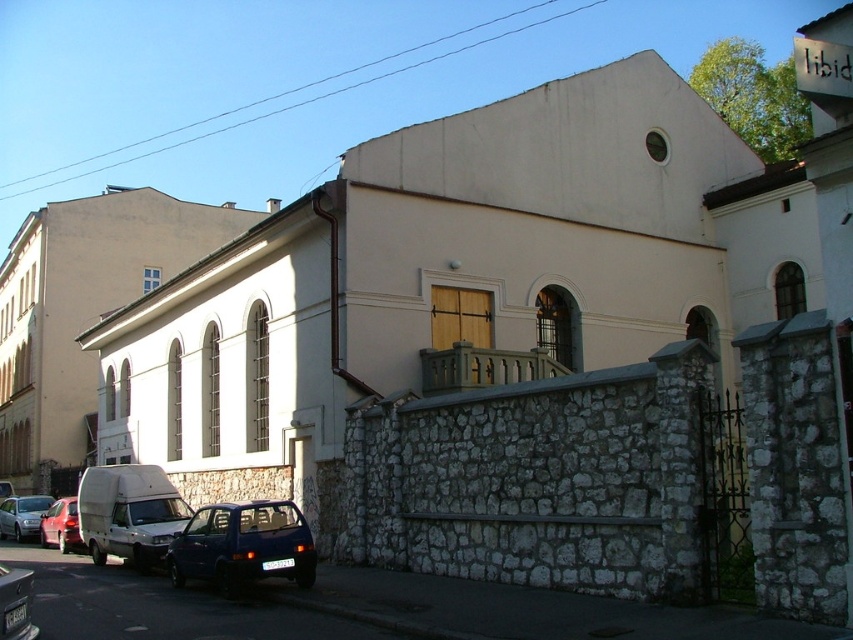
You are standing in front of the building and want to take a photo. You notice two points marked on the ground at coordinates point (x=128, y=486) and point (x=71, y=541). Which point is closer to your current position?

Point (x=128, y=486) is closer to the camera than point (x=71, y=541), so it is closer to your current position.

You are standing at the point marked by point (83, 310). Looking towards the white stone church at upper left, which direction should you walk to reach the building with the wooden door on the second floor?

The point (83, 310) marks the white stone church at upper left, so you are already at the church. To reach the building with the wooden door on the second floor, you should walk towards the building located in the lower part of the image, likely straight ahead or downward direction depending on the layout.